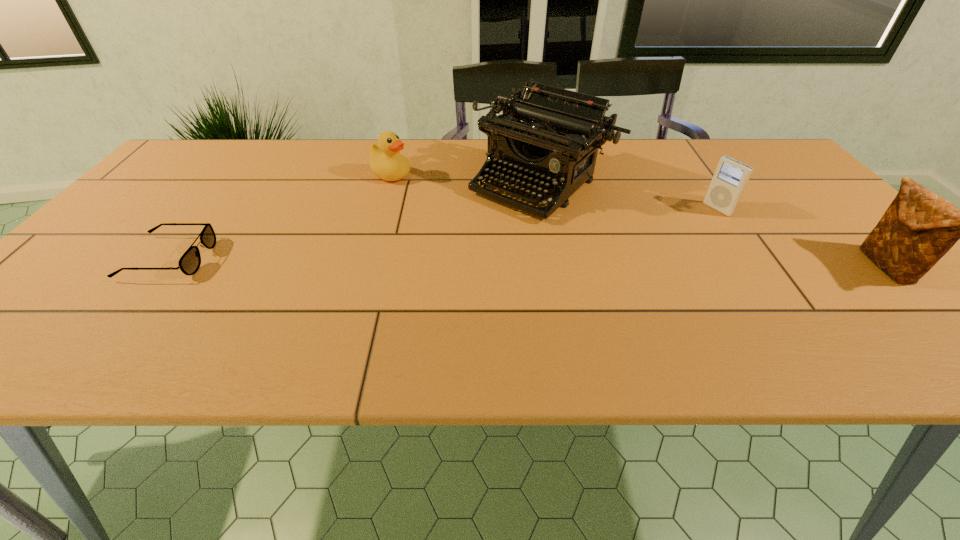
Locate an element on the screen. This screenshot has width=960, height=540. vacant space located 0.300m on the keyboard of the third object from right to left is located at coordinates (422, 284).

Locate an element on the screen. duck present at the far edge is located at coordinates (386, 162).

You are a GUI agent. You are given a task and a screenshot of the screen. Output one action in this format:
    pyautogui.click(x=<x>, y=<y>)
    Task: Click on the typewriter located in the far edge section of the desktop
    This screenshot has height=540, width=960.
    Given the screenshot: What is the action you would take?
    pyautogui.click(x=550, y=136)

The image size is (960, 540). What are the coordinates of `object at the near edge` in the screenshot? It's located at (919, 227).

I want to click on object at the left edge, so 189,263.

Identify the location of object that is positioned at the right edge. The width and height of the screenshot is (960, 540). (919, 227).

Where is `object that is at the near right corner`? The image size is (960, 540). object that is at the near right corner is located at coordinates (919, 227).

This screenshot has height=540, width=960. Find the location of `free space at the far edge`. free space at the far edge is located at coordinates (300, 144).

At what (x,y) coordinates should I click in order to perform the action: click on free location at the near edge of the desktop. Please return your answer as a coordinate pair (x, y). Looking at the image, I should click on (776, 305).

Identify the location of free space at the left edge. (135, 225).